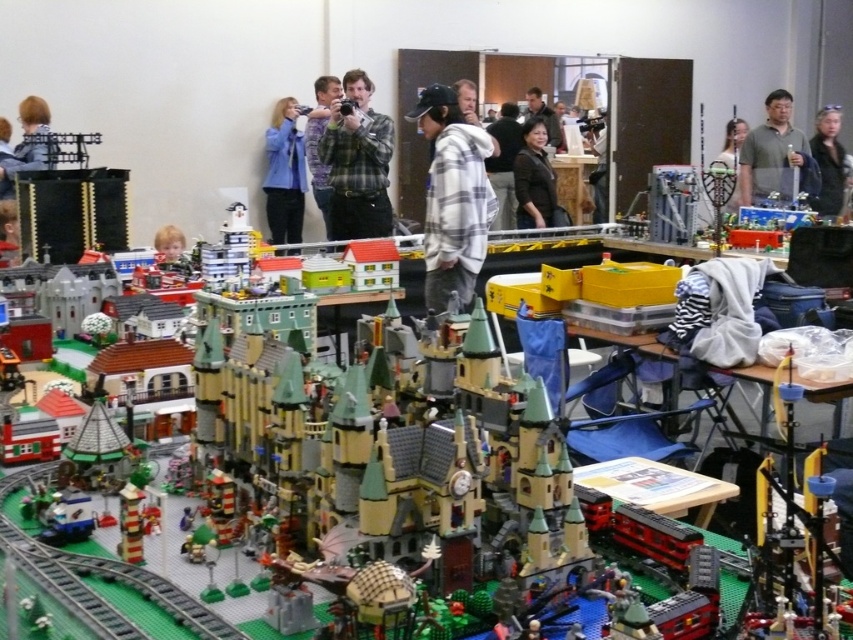
Question: Which point is farther to the camera?

Choices:
 (A) matte blue jacket at upper center
 (B) smooth plastic head at center

Answer: (B)

Question: Does matte gray shirt at center have a smaller size compared to light brown hair at center?

Choices:
 (A) yes
 (B) no

Answer: (A)

Question: Is light brown hair at upper left to the right of matte black shirt at center from the viewer's perspective?

Choices:
 (A) yes
 (B) no

Answer: (B)

Question: Which of the following is the farthest from the observer?

Choices:
 (A) plaid hoodie at center
 (B) black leather jacket at upper right

Answer: (B)

Question: Which point is farther from the camera taking this photo?

Choices:
 (A) pos(28,150)
 (B) pos(297,163)
 (C) pos(527,168)
 (D) pos(461,252)

Answer: (B)

Question: Is black leather jacket at upper right bigger than light brown hair at center?

Choices:
 (A) no
 (B) yes

Answer: (B)